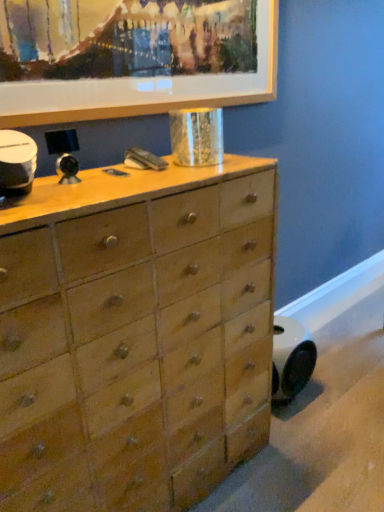
Question: From the image's perspective, relative to wooden picture frame at upper center, is natural wood chest of drawers at center above or below?

Choices:
 (A) below
 (B) above

Answer: (A)

Question: Do you think natural wood chest of drawers at center is within wooden picture frame at upper center, or outside of it?

Choices:
 (A) outside
 (B) inside

Answer: (A)

Question: Is point (104, 479) closer or farther from the camera than point (162, 16)?

Choices:
 (A) farther
 (B) closer

Answer: (B)

Question: Choose the correct answer: Is wooden picture frame at upper center inside natural wood chest of drawers at center or outside it?

Choices:
 (A) outside
 (B) inside

Answer: (A)

Question: Is wooden picture frame at upper center to the left or to the right of natural wood chest of drawers at center in the image?

Choices:
 (A) left
 (B) right

Answer: (B)

Question: In terms of size, does wooden picture frame at upper center appear bigger or smaller than natural wood chest of drawers at center?

Choices:
 (A) big
 (B) small

Answer: (B)

Question: Considering the positions of wooden picture frame at upper center and natural wood chest of drawers at center in the image, is wooden picture frame at upper center taller or shorter than natural wood chest of drawers at center?

Choices:
 (A) tall
 (B) short

Answer: (B)